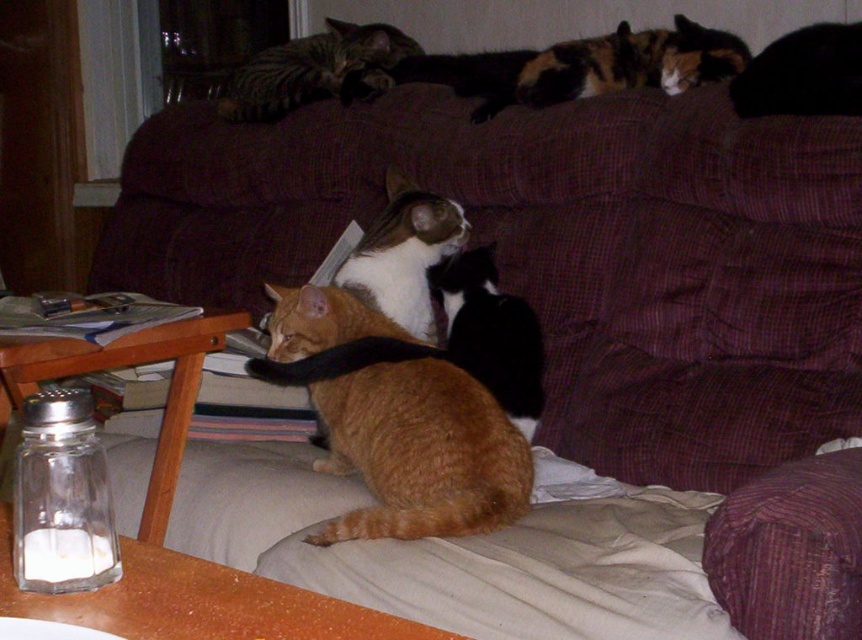
Question: Can you confirm if striped fur cat at upper center is positioned above white fur at center?

Choices:
 (A) no
 (B) yes

Answer: (B)

Question: Which point is closer to the camera?

Choices:
 (A) (507, 77)
 (B) (781, 77)
 (C) (361, 260)
 (D) (345, 33)

Answer: (B)

Question: Which point is closer to the camera?

Choices:
 (A) (491, 390)
 (B) (436, 64)

Answer: (A)

Question: Can you confirm if striped fur cat at upper center is positioned to the right of black fur cat at center?

Choices:
 (A) no
 (B) yes

Answer: (A)

Question: Is orange fur cat at center further to camera compared to black and white fur at center?

Choices:
 (A) no
 (B) yes

Answer: (A)

Question: Which point appears farthest from the camera in this image?

Choices:
 (A) (729, 67)
 (B) (490, 307)
 (C) (311, 44)

Answer: (C)